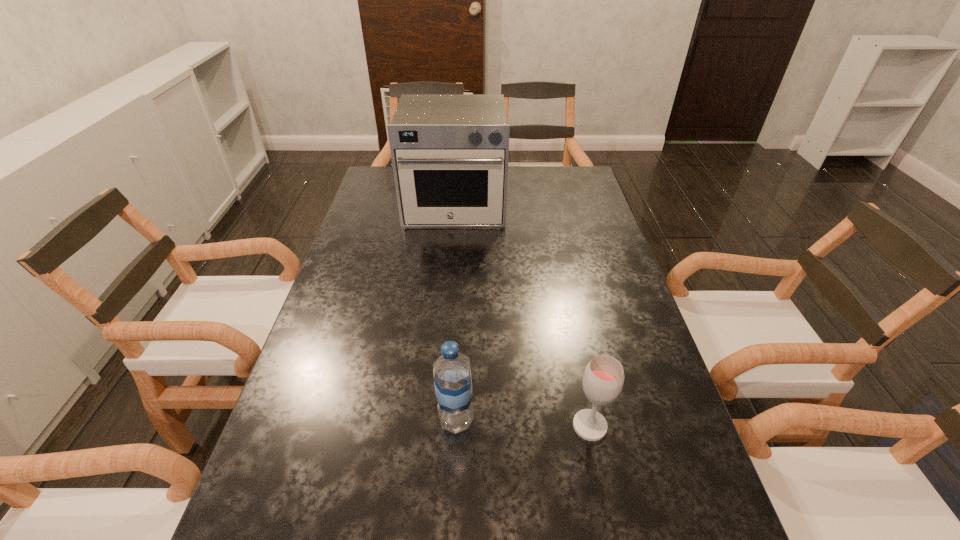
Find the location of a particular element. This screenshot has width=960, height=540. object that is at the right edge is located at coordinates (603, 378).

At what (x,y) coordinates should I click in order to perform the action: click on object situated at the far left corner. Please return your answer as a coordinate pair (x, y). The image size is (960, 540). Looking at the image, I should click on (449, 152).

At what (x,y) coordinates should I click in order to perform the action: click on vacant region at the far edge of the desktop. Please return your answer as a coordinate pair (x, y). The width and height of the screenshot is (960, 540). Looking at the image, I should click on (519, 175).

In the image, there is a desktop. What are the coordinates of `vacant space at the left edge` in the screenshot? It's located at (393, 222).

This screenshot has height=540, width=960. I want to click on vacant space at the right edge of the desktop, so click(x=573, y=235).

In the image, there is a desktop. Where is `free space at the far right corner`? The width and height of the screenshot is (960, 540). free space at the far right corner is located at coordinates (566, 171).

This screenshot has width=960, height=540. In order to click on blank region between the rightmost object and the farthest object in this screenshot , I will do `click(522, 316)`.

The height and width of the screenshot is (540, 960). I want to click on free spot between the water bottle and the tallest object, so click(455, 313).

Find the location of `free space between the shortest object and the toaster oven`. free space between the shortest object and the toaster oven is located at coordinates click(x=522, y=316).

Find the location of a particular element. Image resolution: width=960 pixels, height=540 pixels. vacant space that is in between the shortest object and the water bottle is located at coordinates (523, 423).